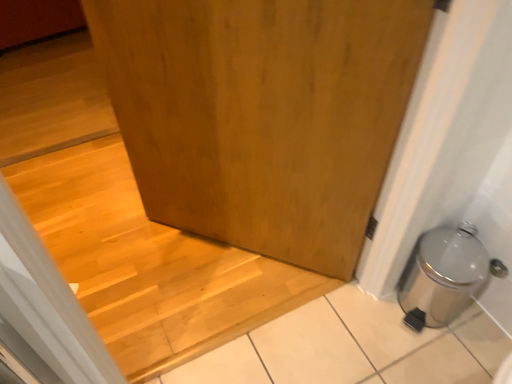
Question: Looking at their shapes, would you say wooden at center is wider or thinner than silver metallic trash can at lower right?

Choices:
 (A) wide
 (B) thin

Answer: (A)

Question: From a real-world perspective, is wooden at center above or below silver metallic trash can at lower right?

Choices:
 (A) below
 (B) above

Answer: (A)

Question: Estimate the real-world distances between objects in this image. Which object is closer to the wooden door at center?

Choices:
 (A) silver metallic trash can at lower right
 (B) wooden at center

Answer: (B)

Question: Which of these objects is positioned farthest from the wooden at center?

Choices:
 (A) silver metallic trash can at lower right
 (B) wooden door at center

Answer: (A)